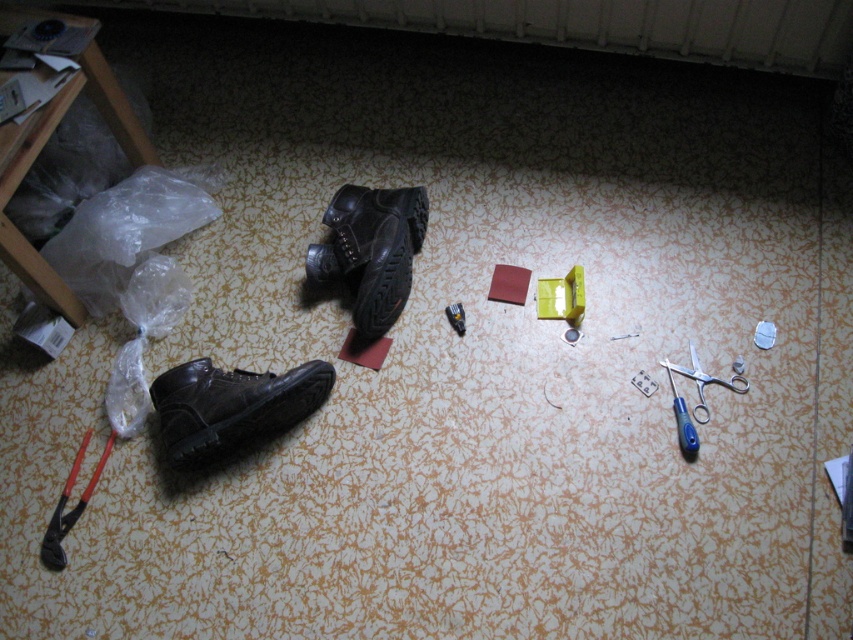
Does black leather boot at lower left appear on the left side of blue plastic scissors at lower right?

Indeed, black leather boot at lower left is positioned on the left side of blue plastic scissors at lower right.

Is black leather boot at lower left to the right of blue plastic scissors at lower right from the viewer's perspective?

Incorrect, black leather boot at lower left is not on the right side of blue plastic scissors at lower right.

Is point (221, 401) in front of point (703, 396)?

Yes, point (221, 401) is closer to viewer.

The width and height of the screenshot is (853, 640). I want to click on black leather boot at lower left, so click(231, 406).

Can you confirm if black leather boot at lower left is positioned to the left of leather shoe at center?

Indeed, black leather boot at lower left is positioned on the left side of leather shoe at center.

Which is in front, point (244, 442) or point (387, 248)?

Positioned in front is point (244, 442).

Identify the location of black leather boot at lower left. (231, 406).

Which is more to the right, black leather boot at lower left or black rubber pliers at lower left?

black leather boot at lower left is more to the right.

Is black leather boot at lower left behind black rubber pliers at lower left?

No.

This screenshot has height=640, width=853. In order to click on black leather boot at lower left in this screenshot , I will do `click(231, 406)`.